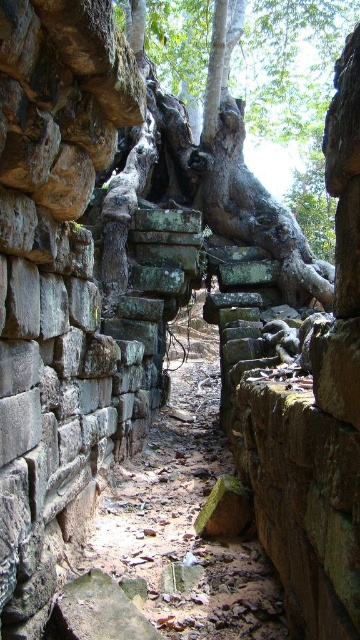
You are an archaeologist exploring the narrow pathway between the brown stone path at center and the green rough bark tree at center. You need to place a 10 feet long protective barrier between them. Is there enough space to fit it?

The brown stone path at center is 13.58 feet from the green rough bark tree at center, so yes, there is enough space to place a 10 feet long protective barrier between them since the distance is greater than the barrier length.

Looking at this image, you are standing on the pathway and want to walk towards the point that is closer to you. Which point should you walk towards, point [203,397] or point [186,148]?

You should walk towards point [186,148] because it is closer to you than point [203,397], which is further away.

You are an archaeologist walking along the brown stone path at center in the ancient site. You notice the green rough bark tree at center above you. In which direction is the tree relative to the path?

The green rough bark tree at center is above the brown stone path at center, so the tree is located above the path.